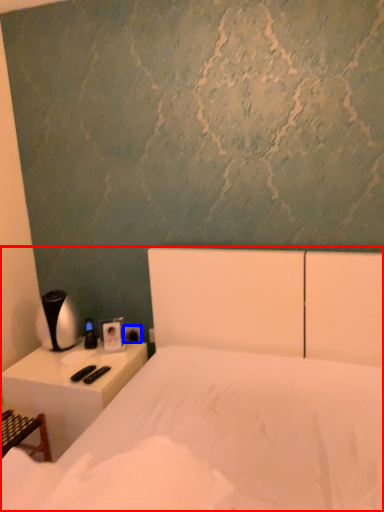
Question: Which object appears farthest to the camera in this image, bed (highlighted by a red box) or electric outlet (highlighted by a blue box)?

Choices:
 (A) bed
 (B) electric outlet

Answer: (B)